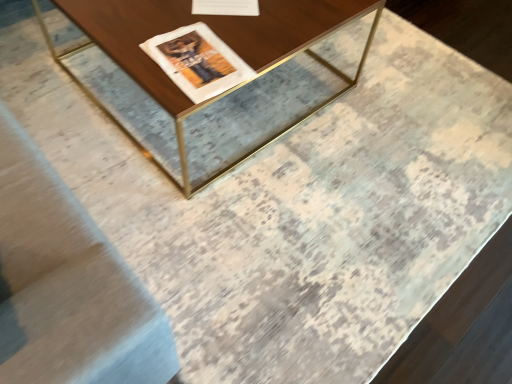
The height and width of the screenshot is (384, 512). What do you see at coordinates (221, 92) in the screenshot?
I see `matte gold table at center` at bounding box center [221, 92].

Locate an element on the screen. matte gold table at center is located at coordinates (221, 92).

Where is `matte gold table at center`? This screenshot has height=384, width=512. matte gold table at center is located at coordinates (221, 92).